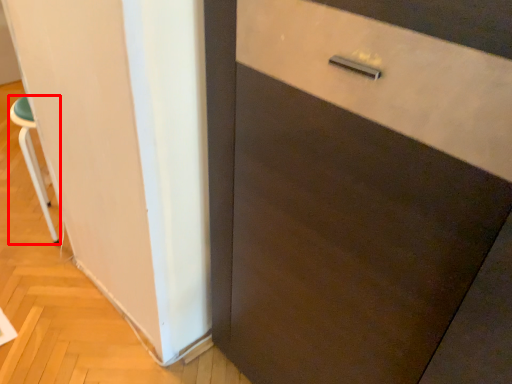
Question: From the image's perspective, what is the correct spatial relationship of furniture (annotated by the red box) in relation to barn door?

Choices:
 (A) above
 (B) below

Answer: (A)